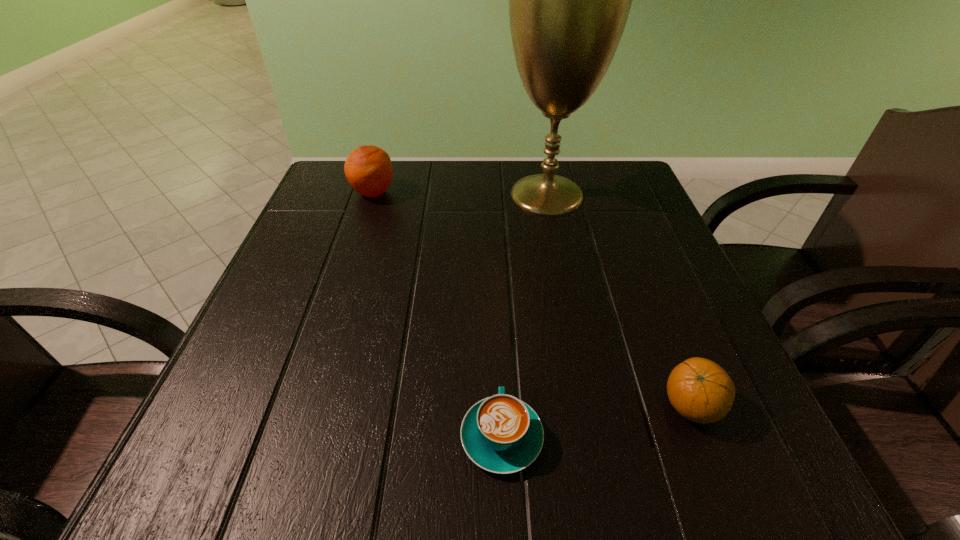
Identify the location of the tallest object. This screenshot has width=960, height=540. (569, 0).

Locate an element on the screen. The width and height of the screenshot is (960, 540). the left orange is located at coordinates (368, 169).

Where is `the taller orange`? The image size is (960, 540). the taller orange is located at coordinates (368, 169).

Identify the location of the second shortest object. (700, 390).

Locate an element on the screen. The width and height of the screenshot is (960, 540). the shorter orange is located at coordinates (700, 390).

The width and height of the screenshot is (960, 540). I want to click on cappuccino, so click(501, 434).

In order to click on free spot located 0.330m on the left of the tallest object in this screenshot , I will do `click(364, 194)`.

This screenshot has width=960, height=540. In order to click on free space located on the back of the left orange in this screenshot , I will do tap(382, 165).

The width and height of the screenshot is (960, 540). I want to click on free region located 0.330m on the left of the shorter orange, so click(x=436, y=407).

The image size is (960, 540). Identify the location of vacant space located with the handle on the right side of the shortest object. (498, 333).